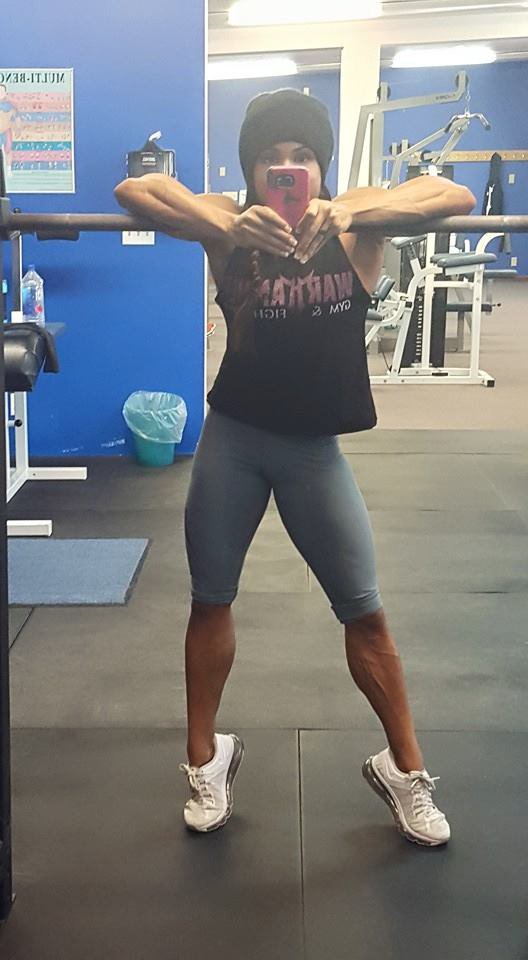
Where is `bottle`? The height and width of the screenshot is (960, 528). bottle is located at coordinates (33, 278).